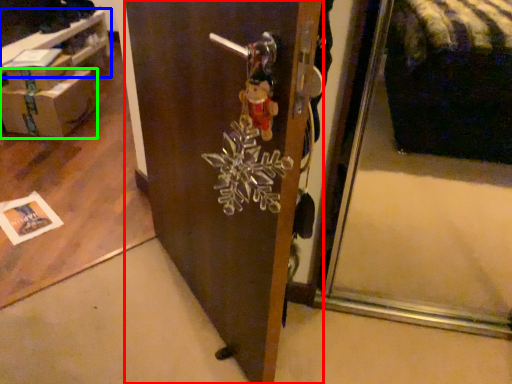
Question: Which object is positioned closest to door (highlighted by a red box)? Select from table (highlighted by a blue box) and box (highlighted by a green box).

Choices:
 (A) table
 (B) box

Answer: (B)